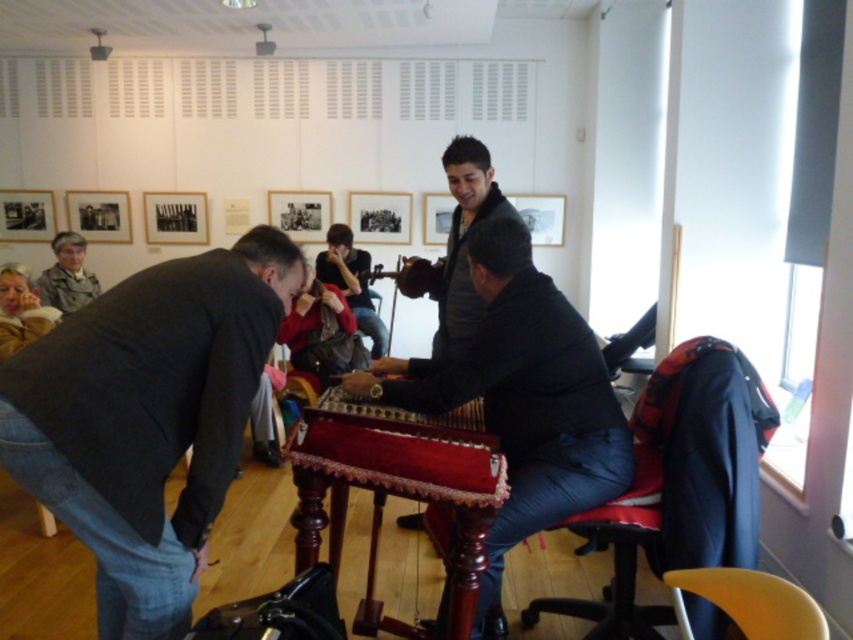
Question: Does velvet-covered wooden table at center lie behind yellow plastic chair at lower right?

Choices:
 (A) no
 (B) yes

Answer: (B)

Question: Which point is closer to the camera taking this photo?

Choices:
 (A) (141, 332)
 (B) (440, 156)

Answer: (A)

Question: Does dark gray sweater at center lie in front of red velvet guitar at center?

Choices:
 (A) no
 (B) yes

Answer: (B)

Question: Which object is farther from the camera taking this photo?

Choices:
 (A) red fabric chair at lower right
 (B) yellow plastic chair at lower right
 (C) camouflage fabric jacket at upper left

Answer: (C)

Question: Which point is farther to the camera?

Choices:
 (A) (401, 269)
 (B) (62, 260)
 (C) (13, 328)
 (D) (334, 360)

Answer: (B)

Question: Does dark blue fabric jacket at center come behind black matte picture frame at upper left?

Choices:
 (A) no
 (B) yes

Answer: (A)